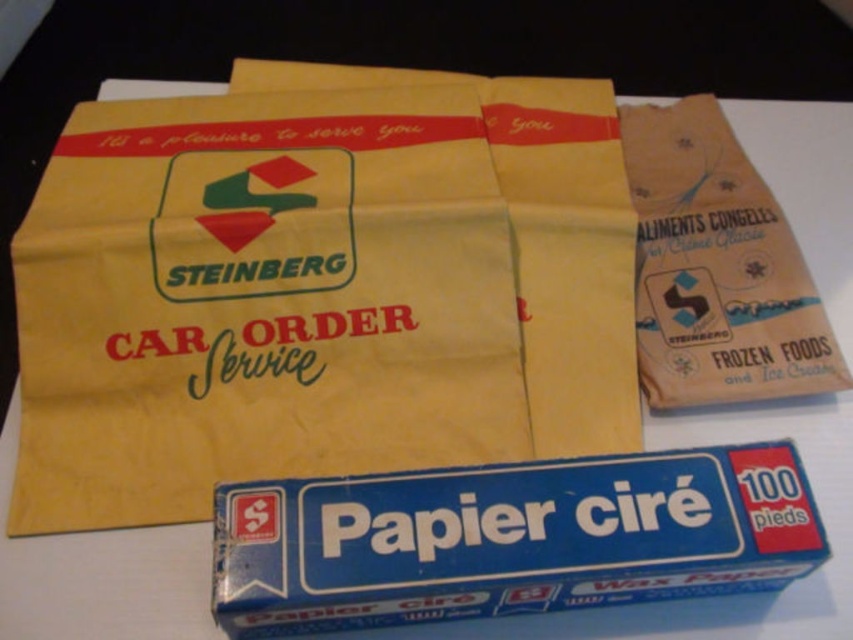
This screenshot has width=853, height=640. Describe the element at coordinates (259, 301) in the screenshot. I see `yellow paper bag at upper center` at that location.

Is point (502, 259) closer to camera compared to point (236, 600)?

That is False.

In order to click on yellow paper bag at upper center in this screenshot , I will do `click(259, 301)`.

Is yellow paper bag at upper center shorter than brown paper bag at upper right?

Incorrect, yellow paper bag at upper center's height does not fall short of brown paper bag at upper right's.

Who is more distant from viewer, [463,353] or [646,346]?

Point [646,346]

Image resolution: width=853 pixels, height=640 pixels. Identify the location of yellow paper bag at upper center. (259, 301).

Is blue paper wax paper at lower center below brown paper bag at upper right?

Correct, blue paper wax paper at lower center is located below brown paper bag at upper right.

Where is `blue paper wax paper at lower center`? This screenshot has width=853, height=640. blue paper wax paper at lower center is located at coordinates (509, 538).